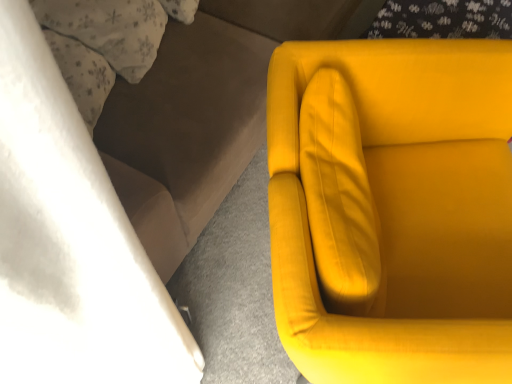
The width and height of the screenshot is (512, 384). What do you see at coordinates (404, 211) in the screenshot?
I see `matte yellow armchair at right` at bounding box center [404, 211].

This screenshot has height=384, width=512. What are the coordinates of `matte yellow armchair at right` in the screenshot? It's located at coord(404,211).

The height and width of the screenshot is (384, 512). Describe the element at coordinates (199, 115) in the screenshot. I see `velvet yellow couch at right` at that location.

In order to face velvet yellow couch at right, should I rotate leftwards or rightwards?

It's best to rotate left around 8.687 degrees.

Identify the location of velvet yellow couch at right. [x=199, y=115].

At what (x,y) coordinates should I click in order to perform the action: click on matte yellow armchair at right. Please return your answer as a coordinate pair (x, y). Looking at the image, I should click on [x=404, y=211].

Is matte yellow armchair at right to the right of velvet yellow couch at right from the viewer's perspective?

Yes.

Which object is closer to the camera taking this photo, matte yellow armchair at right or velvet yellow couch at right?

Positioned in front is matte yellow armchair at right.

Is point (396, 242) closer or farther from the camera than point (200, 108)?

Point (396, 242) is positioned closer to the camera compared to point (200, 108).

In the scene shown: From the image's perspective, which is above, matte yellow armchair at right or velvet yellow couch at right?

velvet yellow couch at right.

From a real-world perspective, is matte yellow armchair at right physically located above or below velvet yellow couch at right?

From a real-world perspective, matte yellow armchair at right is physically below velvet yellow couch at right.

In terms of width, does matte yellow armchair at right look wider or thinner when compared to velvet yellow couch at right?

In the image, matte yellow armchair at right appears to be more narrow than velvet yellow couch at right.

Is matte yellow armchair at right taller or shorter than velvet yellow couch at right?

matte yellow armchair at right is shorter than velvet yellow couch at right.

Can you confirm if matte yellow armchair at right is bigger than velvet yellow couch at right?

No.

Which is correct: matte yellow armchair at right is inside velvet yellow couch at right, or outside of it?

matte yellow armchair at right cannot be found inside velvet yellow couch at right.

Are matte yellow armchair at right and velvet yellow couch at right far apart?

They are positioned close to each other.

Is matte yellow armchair at right turned away from velvet yellow couch at right?

Yes, matte yellow armchair at right is positioned with its back facing velvet yellow couch at right.

How different are the orientations of matte yellow armchair at right and velvet yellow couch at right in degrees?

The angular difference between matte yellow armchair at right and velvet yellow couch at right is 29.1 degrees.

You are a GUI agent. You are given a task and a screenshot of the screen. Output one action in this format:
    pyautogui.click(x=<x>, y=<y>)
    Task: Click on the couch above the matte yellow armchair at right (from a real-world perspective)
    Image resolution: width=512 pixels, height=384 pixels.
    Given the screenshot: What is the action you would take?
    click(x=199, y=115)

Considering the positions of objects velvet yellow couch at right and matte yellow armchair at right in the image provided, who is more to the right, velvet yellow couch at right or matte yellow armchair at right?

From the viewer's perspective, matte yellow armchair at right appears more on the right side.

Which is in front, velvet yellow couch at right or matte yellow armchair at right?

matte yellow armchair at right is closer to the camera.

Which point is more distant from viewer, [232,9] or [272,218]?

The point [232,9] is more distant.

From the image's perspective, does velvet yellow couch at right appear lower than matte yellow armchair at right?

Incorrect, from the image's perspective, velvet yellow couch at right is higher than matte yellow armchair at right.

From a real-world perspective, is velvet yellow couch at right physically located above or below matte yellow armchair at right?

From a real-world perspective, velvet yellow couch at right is physically above matte yellow armchair at right.

Considering the relative sizes of velvet yellow couch at right and matte yellow armchair at right in the image provided, is velvet yellow couch at right thinner than matte yellow armchair at right?

No.

In terms of height, does velvet yellow couch at right look taller or shorter compared to matte yellow armchair at right?

Considering their sizes, velvet yellow couch at right has more height than matte yellow armchair at right.

Is velvet yellow couch at right bigger or smaller than matte yellow armchair at right?

Clearly, velvet yellow couch at right is larger in size than matte yellow armchair at right.

Is velvet yellow couch at right positioned beyond the bounds of matte yellow armchair at right?

velvet yellow couch at right lies outside matte yellow armchair at right's area.

Is velvet yellow couch at right beside matte yellow armchair at right?

No, velvet yellow couch at right is not next to matte yellow armchair at right.

Is velvet yellow couch at right facing away from matte yellow armchair at right?

No, velvet yellow couch at right is not facing away from matte yellow armchair at right.

What's the angular difference between velvet yellow couch at right and matte yellow armchair at right's facing directions?

velvet yellow couch at right and matte yellow armchair at right are facing 29.1 degrees away from each other.

You are a GUI agent. You are given a task and a screenshot of the screen. Output one action in this format:
    pyautogui.click(x=<x>, y=<y>)
    Task: Click on the couch that is above the matte yellow armchair at right (from a real-world perspective)
    This screenshot has width=512, height=384.
    Given the screenshot: What is the action you would take?
    point(199,115)

What are the coordinates of `chair in front of the velvet yellow couch at right` in the screenshot? It's located at (404, 211).

Locate an element on the screen. This screenshot has width=512, height=384. chair below the velvet yellow couch at right (from a real-world perspective) is located at coordinates (404, 211).